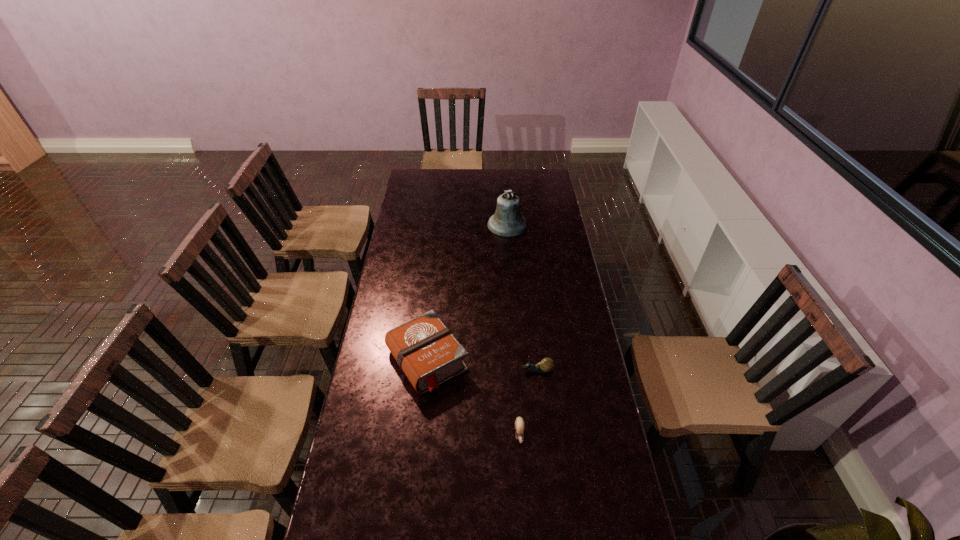
Locate an element on the screen. Image resolution: width=960 pixels, height=540 pixels. free spot between the right escargot and the shortest object is located at coordinates (529, 402).

What are the coordinates of `free space between the farthest object and the right escargot` in the screenshot? It's located at (522, 298).

Locate an element on the screen. empty location between the shorter escargot and the right escargot is located at coordinates (529, 402).

Where is `unoccupied area between the shorter escargot and the right escargot`? unoccupied area between the shorter escargot and the right escargot is located at coordinates (529, 402).

The width and height of the screenshot is (960, 540). Find the location of `free area in between the nearest object and the farthest object`. free area in between the nearest object and the farthest object is located at coordinates (514, 329).

Identify the location of empty location between the leftmost object and the nearer escargot. (473, 397).

Image resolution: width=960 pixels, height=540 pixels. Identify the location of free space between the farthest object and the second shortest object. (522, 298).

In order to click on free space between the right escargot and the nearer escargot in this screenshot , I will do `click(529, 402)`.

Where is `empty space that is in between the right escargot and the Bible`? empty space that is in between the right escargot and the Bible is located at coordinates [x=483, y=365].

Find the location of a particular element. This screenshot has width=960, height=540. free space between the taller escargot and the leftmost object is located at coordinates (483, 365).